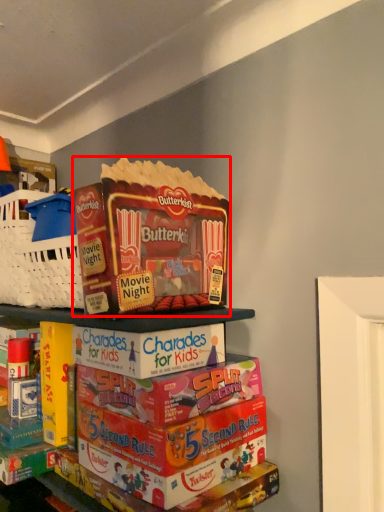
Question: From the image's perspective, what is the correct spatial positioning of product (annotated by the red box) in reference to shelf?

Choices:
 (A) above
 (B) below

Answer: (A)